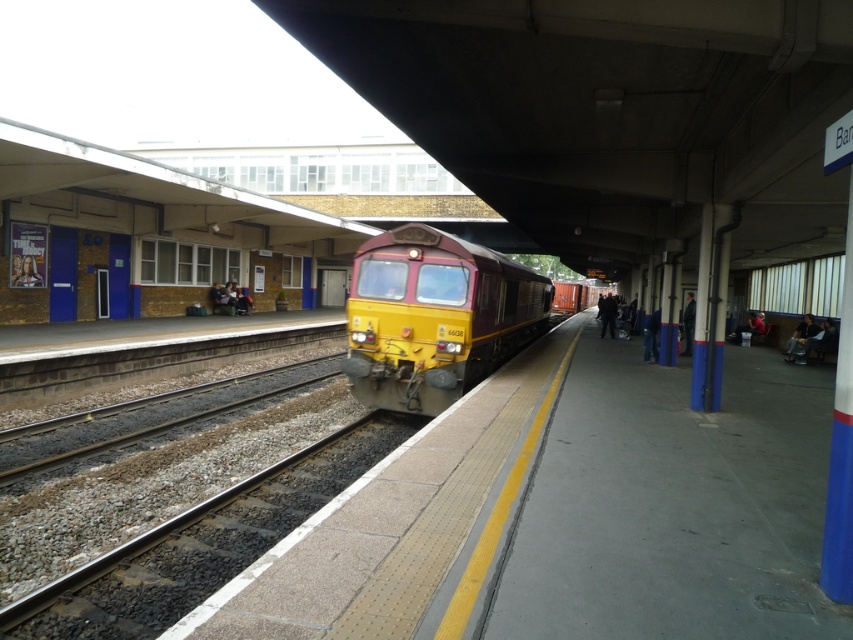
You are standing on the platform at the railway station. You see a point marked at coordinates (196,547). What is located at that point?

The point at coordinates (196,547) indicates gravel railway track at center.

You are a railway inspector checking the tracks between the gravel railway track at center and the brown gravel track at center. Which track is positioned to the right side when viewed from the platform?

The gravel railway track at center is positioned to the right of the brown gravel track at center.

In the scene shown: You are a maintenance worker on the platform and need to check the height of the gravel railway track at center and the yellow polished metal train at center. Which object is taller?

The gravel railway track at center is not as tall as the yellow polished metal train at center, so the yellow polished metal train at center is taller.